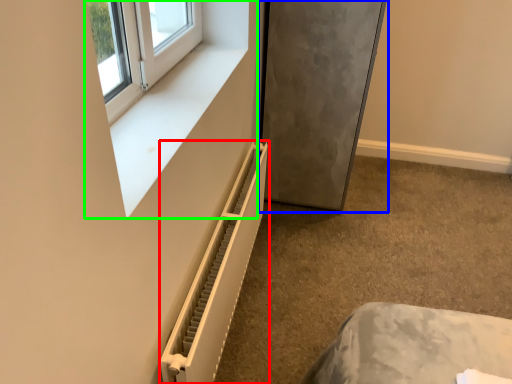
Question: Considering the real-world distances, which object is farthest from radiator (highlighted by a red box)? fridge (highlighted by a blue box) or window frame (highlighted by a green box)?

Choices:
 (A) fridge
 (B) window frame

Answer: (A)